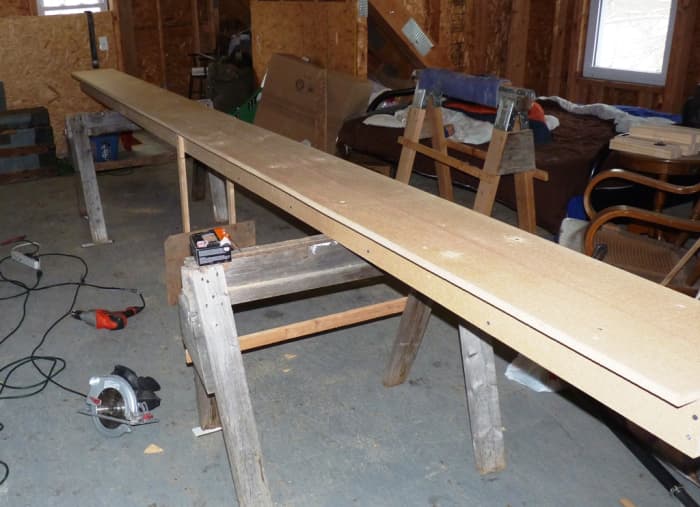
Image resolution: width=700 pixels, height=507 pixels. Identify the location of chair. (623, 257).